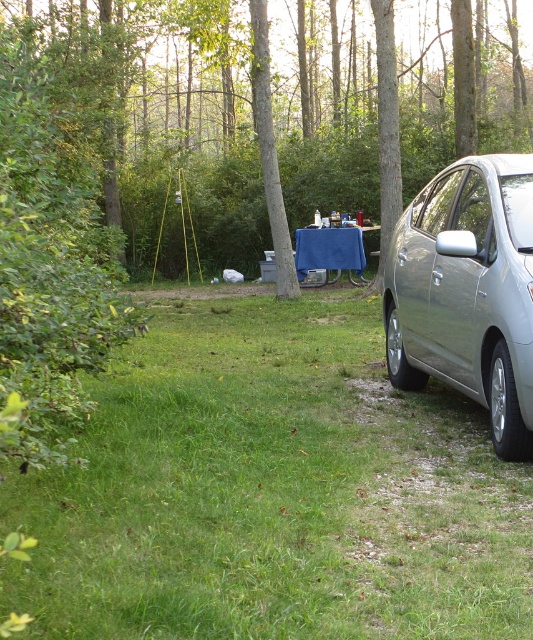
You are planning to set up a tent between the green leafy tree at center and the blue fabric picnic table at center. Based on their widths, which object might require more space on the sides for the tent setup?

The green leafy tree at center might be wider than the blue fabric picnic table at center, so it might require more space on the sides for the tent setup.

You are a photographer setting up for a shoot. You want to capture both the green leafy tree at center and the silver metallic car at right in your frame. Based on the scene, which object will appear larger in the photo?

The green leafy tree at center will appear larger in the photo because it is positioned in front of the silver metallic car at right, making it closer to the camera and thus appear bigger.

You are a photographer setting up for an outdoor shoot. You have a camera mounted on a tripod that requires a clear view of the silver metallic car at right and the blue fabric picnic table at center. Which object will appear larger in your camera frame if both are in focus?

The silver metallic car at right will appear larger in the camera frame because it is taller than the blue fabric picnic table at center.